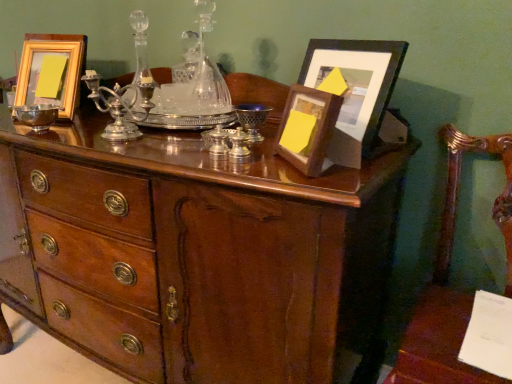
What are the coordinates of `vacant space in between shiny silver bowl at left and silver polished candle holder at center, acting as the 3th candle holder starting from the right` in the screenshot? It's located at (69, 135).